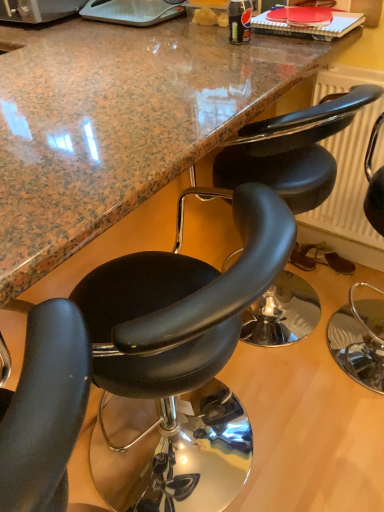
What do you see at coordinates (292, 150) in the screenshot?
I see `black leather chair at center, the 2th chair viewed from the left` at bounding box center [292, 150].

Measure the distance between black leather chair at right, which is the 1th chair in right-to-left order, and camera.

They are 1.39 meters apart.

Image resolution: width=384 pixels, height=512 pixels. Identify the location of marble countertop at center. (119, 123).

What do you see at coordinates (172, 329) in the screenshot? The image size is (384, 512). I see `black leather chair at center, the 3th chair viewed from the right` at bounding box center [172, 329].

This screenshot has width=384, height=512. Identify the location of black leather chair at center, the 2th chair viewed from the left. (292, 150).

Considering the points (103, 142) and (336, 338), which point is in front, point (103, 142) or point (336, 338)?

The point (103, 142) is closer to the camera.

Looking at this image, what's the angular difference between marble countertop at center and black leather chair at right, which appears as the third chair when viewed from the left,'s facing directions?

They differ by 0.333 degrees in their facing directions.

Who is shorter, marble countertop at center or black leather chair at right, which is the 1th chair in right-to-left order?

Standing shorter between the two is black leather chair at right, which is the 1th chair in right-to-left order.

Is black leather chair at center, arranged as the 1th chair when viewed from the left, not within marble countertop at center?

That's incorrect, black leather chair at center, arranged as the 1th chair when viewed from the left, is not completely outside marble countertop at center.

From the marble countertop at center, count 1st chairs backward and point to it. Please provide its 2D coordinates.

[(172, 329)]

Which object is positioned more to the left, black leather chair at center, the 3th chair viewed from the right, or marble countertop at center?

Positioned to the left is marble countertop at center.

From a real-world perspective, is black leather chair at center, the 3th chair viewed from the right, positioned above or below marble countertop at center?

In terms of real-world spatial position, black leather chair at center, the 3th chair viewed from the right, is below marble countertop at center.

Is black leather chair at center, the 2th chair viewed from the left, taller or shorter than marble countertop at center?

Clearly, black leather chair at center, the 2th chair viewed from the left, is shorter compared to marble countertop at center.

From a real-world perspective, relative to marble countertop at center, is black leather chair at center, the 2th chair in the right-to-left sequence, vertically above or below?

Clearly, from a real-world perspective, black leather chair at center, the 2th chair in the right-to-left sequence, is below marble countertop at center.

Considering the relative positions of marble countertop at center and black leather chair at center, the 2th chair viewed from the left, in the image provided, is marble countertop at center to the left of black leather chair at center, the 2th chair viewed from the left, from the viewer's perspective?

Correct, you'll find marble countertop at center to the left of black leather chair at center, the 2th chair viewed from the left.

Considering the relative sizes of marble countertop at center and black leather chair at center, the 2th chair viewed from the left, in the image provided, is marble countertop at center bigger than black leather chair at center, the 2th chair viewed from the left,?

Correct, marble countertop at center is larger in size than black leather chair at center, the 2th chair viewed from the left.

Is marble countertop at center facing towards black leather chair at center, the 2th chair viewed from the left?

Yes, marble countertop at center is facing black leather chair at center, the 2th chair viewed from the left.

Is marble countertop at center in front of black leather chair at center, the 2th chair in the right-to-left sequence?

Yes, marble countertop at center is in front of black leather chair at center, the 2th chair in the right-to-left sequence.

From the image's perspective, starting from the marble countertop at center, which chair is the 3rd one below? Please provide its 2D coordinates.

[(172, 329)]

Based on the photo, from the image's perspective, would you say marble countertop at center is shown under black leather chair at center, arranged as the 1th chair when viewed from the left?

Incorrect, from the image's perspective, marble countertop at center is higher than black leather chair at center, arranged as the 1th chair when viewed from the left.

From a real-world perspective, which is physically below, marble countertop at center or black leather chair at center, the 3th chair viewed from the right?

black leather chair at center, the 3th chair viewed from the right, is physically lower.

From the image's perspective, which chair is the 1st one below the black leather chair at center, the 2th chair viewed from the left? Please provide its 2D coordinates.

[(360, 337)]

Is black leather chair at right, which appears as the third chair when viewed from the left, positioned far away from black leather chair at center, the 2th chair in the right-to-left sequence?

No, black leather chair at right, which appears as the third chair when viewed from the left, is not far away from black leather chair at center, the 2th chair in the right-to-left sequence.

From the picture: Considering the relative sizes of black leather chair at right, which appears as the third chair when viewed from the left, and black leather chair at center, the 2th chair in the right-to-left sequence, in the image provided, is black leather chair at right, which appears as the third chair when viewed from the left, taller than black leather chair at center, the 2th chair in the right-to-left sequence,?

Yes, black leather chair at right, which appears as the third chair when viewed from the left, is taller than black leather chair at center, the 2th chair in the right-to-left sequence.

How many degrees apart are the facing directions of black leather chair at right, which is the 1th chair in right-to-left order, and black leather chair at center, the 2th chair viewed from the left?

0.00243 degrees separate the facing orientations of black leather chair at right, which is the 1th chair in right-to-left order, and black leather chair at center, the 2th chair viewed from the left.

From the image's perspective, would you say black leather chair at center, the 2th chair viewed from the left, is positioned over black leather chair at right, which is the 1th chair in right-to-left order?

Indeed, from the image's perspective, black leather chair at center, the 2th chair viewed from the left, is shown above black leather chair at right, which is the 1th chair in right-to-left order.

Is black leather chair at center, the 2th chair in the right-to-left sequence, positioned far away from black leather chair at right, which is the 1th chair in right-to-left order?

black leather chair at center, the 2th chair in the right-to-left sequence, is actually quite close to black leather chair at right, which is the 1th chair in right-to-left order.

Is black leather chair at center, the 2th chair in the right-to-left sequence, wider than black leather chair at right, which is the 1th chair in right-to-left order?

Indeed, black leather chair at center, the 2th chair in the right-to-left sequence, has a greater width compared to black leather chair at right, which is the 1th chair in right-to-left order.

Is the position of black leather chair at center, the 2th chair in the right-to-left sequence, less distant than that of black leather chair at right, which appears as the third chair when viewed from the left?

No, it is not.

Which chair is the 3rd one when counting from the right side of the marble countertop at center? Please provide its 2D coordinates.

[(360, 337)]

The image size is (384, 512). Identify the location of chair that is the 1st one when counting backward from the marble countertop at center. (172, 329).

Based on their spatial positions, is black leather chair at center, the 2th chair in the right-to-left sequence, or marble countertop at center closer to black leather chair at right, which is the 1th chair in right-to-left order?

The object closer to black leather chair at right, which is the 1th chair in right-to-left order, is black leather chair at center, the 2th chair in the right-to-left sequence.

Based on their spatial positions, is black leather chair at center, arranged as the 1th chair when viewed from the left, or black leather chair at center, the 2th chair viewed from the left, closer to black leather chair at right, which is the 1th chair in right-to-left order?

black leather chair at center, the 2th chair viewed from the left, lies closer to black leather chair at right, which is the 1th chair in right-to-left order, than the other object.

Which object lies nearer to the anchor point black leather chair at center, the 2th chair in the right-to-left sequence, marble countertop at center or black leather chair at center, arranged as the 1th chair when viewed from the left?

The object closer to black leather chair at center, the 2th chair in the right-to-left sequence, is marble countertop at center.

Considering their positions, is black leather chair at center, the 2th chair in the right-to-left sequence, positioned closer to marble countertop at center than black leather chair at right, which is the 1th chair in right-to-left order?

Among the two, black leather chair at center, the 2th chair in the right-to-left sequence, is located nearer to marble countertop at center.

From the image, which object appears to be farther from marble countertop at center, black leather chair at center, the 2th chair in the right-to-left sequence, or black leather chair at center, arranged as the 1th chair when viewed from the left?

Based on the image, black leather chair at center, arranged as the 1th chair when viewed from the left, appears to be further to marble countertop at center.

Which object lies further to the anchor point black leather chair at center, arranged as the 1th chair when viewed from the left, black leather chair at center, the 2th chair in the right-to-left sequence, or marble countertop at center?

marble countertop at center is positioned further to the anchor black leather chair at center, arranged as the 1th chair when viewed from the left.

From the image, which object appears to be nearer to marble countertop at center, black leather chair at center, the 3th chair viewed from the right, or black leather chair at center, the 2th chair in the right-to-left sequence?

Result: Among the two, black leather chair at center, the 2th chair in the right-to-left sequence, is located nearer to marble countertop at center.

Looking at the image, which one is located closer to black leather chair at center, arranged as the 1th chair when viewed from the left, black leather chair at right, which is the 1th chair in right-to-left order, or black leather chair at center, the 2th chair in the right-to-left sequence?

Based on the image, black leather chair at center, the 2th chair in the right-to-left sequence, appears to be nearer to black leather chair at center, arranged as the 1th chair when viewed from the left.

Image resolution: width=384 pixels, height=512 pixels. What are the coordinates of `chair between black leather chair at center, the 3th chair viewed from the right, and black leather chair at right, which is the 1th chair in right-to-left order` in the screenshot? It's located at (292, 150).

In order to click on chair between marble countertop at center and black leather chair at center, the 2th chair in the right-to-left sequence, from left to right in this screenshot , I will do `click(172, 329)`.